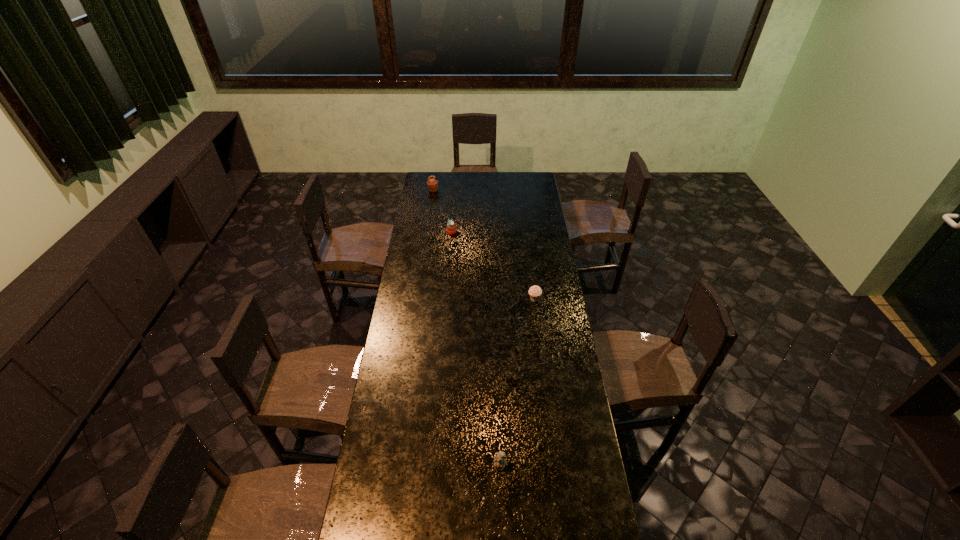
Choose which muffin is the second nearest neighbor to the farthest muffin. Please provide its 2D coordinates. Your answer should be formatted as a tuple, i.e. [(x, y)], where the tuple contains the x and y coordinates of a point satisfying the conditions above.

[(535, 292)]

Where is `the third closest muffin to the nearest object`? The width and height of the screenshot is (960, 540). the third closest muffin to the nearest object is located at coordinates (432, 184).